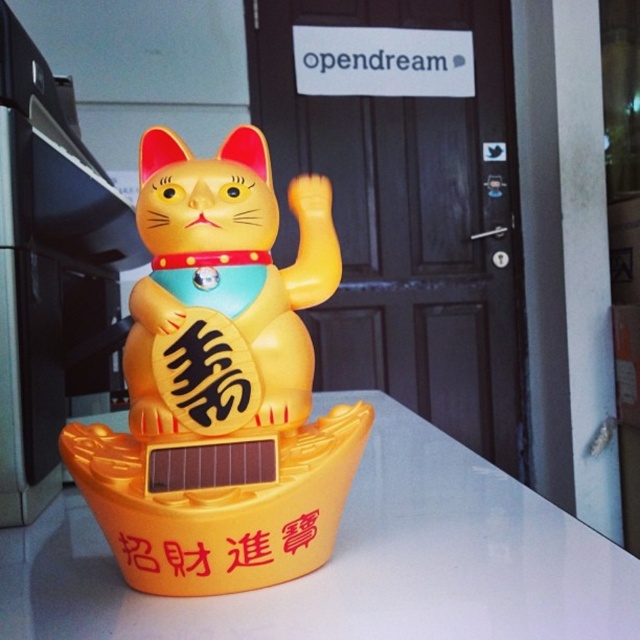
Is point (259, 449) farther from camera compared to point (269, 579)?

No, (259, 449) is closer to viewer.

Between yellow plastic cat at center and yellow matte text at center, which one appears on the left side from the viewer's perspective?

yellow plastic cat at center

Describe the element at coordinates (221, 381) in the screenshot. I see `yellow plastic cat at center` at that location.

Locate an element on the screen. This screenshot has width=640, height=640. yellow plastic cat at center is located at coordinates (221, 381).

Who is more forward, (189, 317) or (179, 554)?

Point (179, 554) is more forward.

Which of these two, yellow matte plastic cat at center or yellow matte text at center, stands shorter?

Standing shorter between the two is yellow matte text at center.

The width and height of the screenshot is (640, 640). I want to click on yellow matte plastic cat at center, so click(x=221, y=291).

Is yellow plastic cat at center to the right of yellow plastic counter top at center from the viewer's perspective?

Incorrect, yellow plastic cat at center is not on the right side of yellow plastic counter top at center.

What do you see at coordinates (221, 381) in the screenshot?
I see `yellow plastic cat at center` at bounding box center [221, 381].

Where is `yellow plastic cat at center`? This screenshot has width=640, height=640. yellow plastic cat at center is located at coordinates (221, 381).